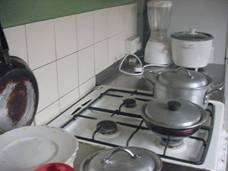
Where is `stove`? This screenshot has height=171, width=228. stove is located at coordinates (135, 118).